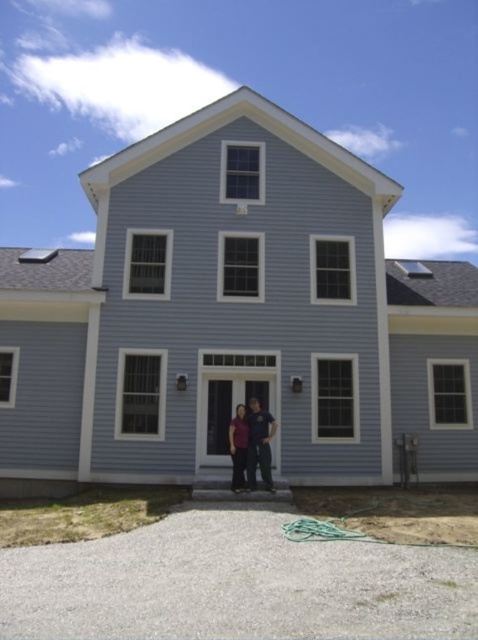
You are a delivery person approaching the house. You notice a matte purple shirt at center and a black fabric woman at center. Which object is wider when viewed from your perspective?

The matte purple shirt at center is wider than the black fabric woman at center.

You are a delivery person standing at the driveway of the house. You see a matte purple shirt at center and a black fabric woman at center. Which object is larger in size?

The matte purple shirt at center is bigger than the black fabric woman at center.

Consider the image. You are standing at the point with coordinates point (237, 480) and want to walk towards the house. Which direction should you go relative to the other point point (231, 436)?

You should walk towards the house in the direction opposite to point (231, 436) since point (237, 480) is in front of it.